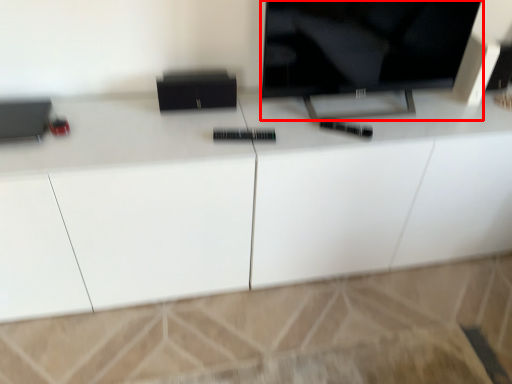
Question: Considering the relative positions of television (annotated by the red box) and cabinetry in the image provided, where is television (annotated by the red box) located with respect to the staircase?

Choices:
 (A) right
 (B) left

Answer: (A)